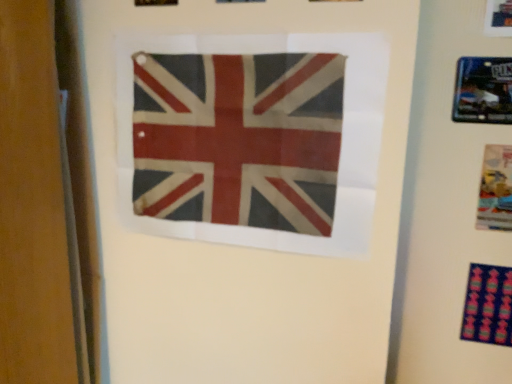
Question: Based on their sizes in the image, would you say multicolored fabric at lower right is bigger or smaller than metallic blue picture frame at upper right?

Choices:
 (A) small
 (B) big

Answer: (A)

Question: From a real-world perspective, is multicolored fabric at lower right positioned above or below metallic blue picture frame at upper right?

Choices:
 (A) above
 (B) below

Answer: (B)

Question: Estimate the real-world distances between objects in this image. Which object is closer to the worn fabric flag at center?

Choices:
 (A) matte plastic poster at right
 (B) metallic blue picture frame at upper right
 (C) multicolored fabric at lower right

Answer: (B)

Question: Which of these objects is positioned farthest from the metallic blue picture frame at upper right?

Choices:
 (A) matte plastic poster at right
 (B) worn fabric flag at center
 (C) multicolored fabric at lower right

Answer: (B)